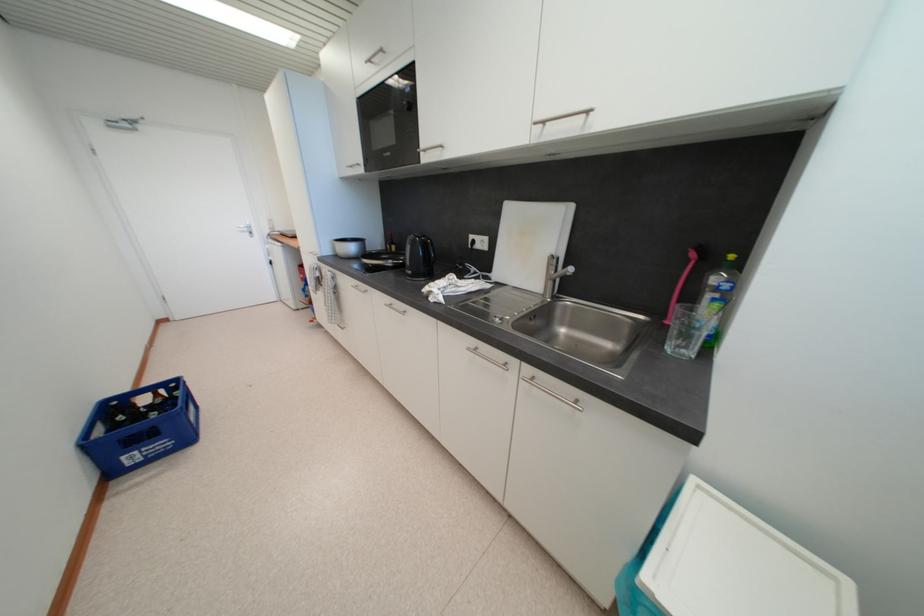
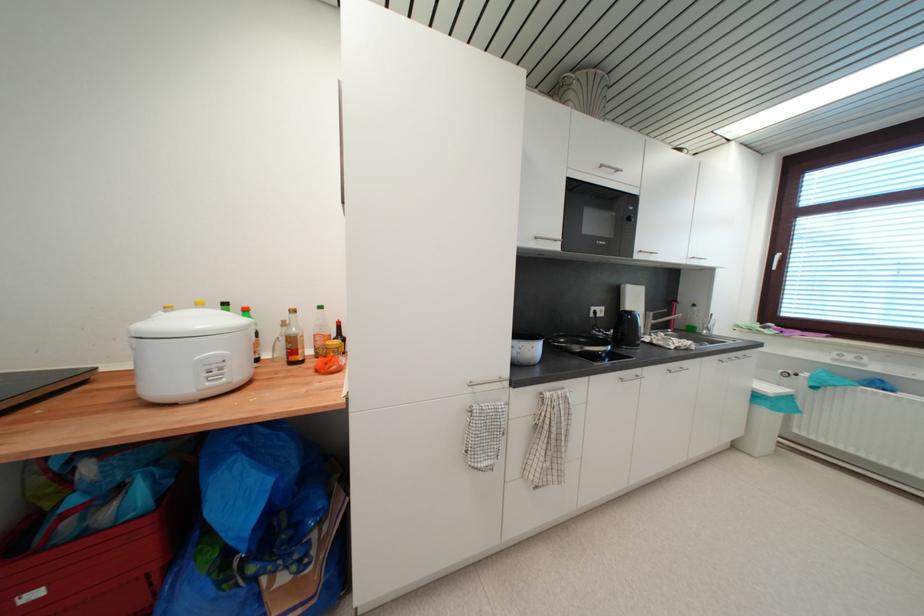
Where in the second image is the point corresponding to [475,248] from the first image?

(597, 317)